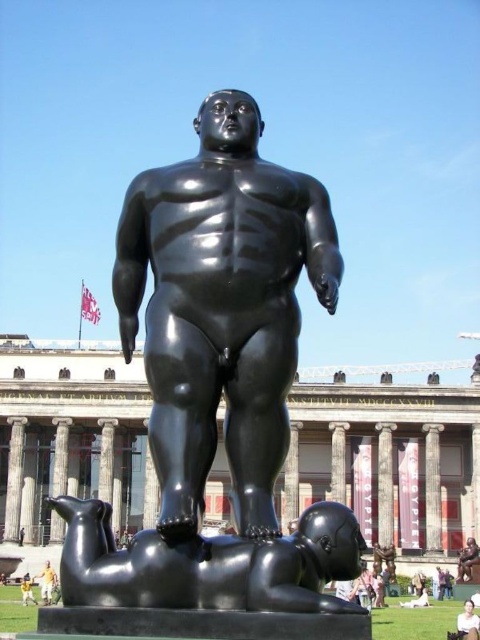
Is smooth gray stone pillar at center positioned at the back of smooth skin person at center?

Yes.

Does smooth gray stone pillar at center have a greater width compared to smooth skin person at center?

In fact, smooth gray stone pillar at center might be narrower than smooth skin person at center.

Between point (19, 440) and point (466, 609), which one is positioned in front?

Point (466, 609) is more forward.

The width and height of the screenshot is (480, 640). I want to click on smooth gray stone pillar at center, so click(x=13, y=477).

Can you confirm if black glossy statue at center is positioned above bronze column at center?

Indeed, black glossy statue at center is positioned over bronze column at center.

Does point (272, 467) lie behind point (54, 492)?

No, (272, 467) is in front of (54, 492).

I want to click on black glossy statue at center, so click(220, 307).

Where is `black glossy statue at center`? The width and height of the screenshot is (480, 640). black glossy statue at center is located at coordinates (220, 307).

The height and width of the screenshot is (640, 480). What do you see at coordinates (208, 563) in the screenshot?
I see `glossy black dog at lower center` at bounding box center [208, 563].

Is glossy black dog at lower center taller than smooth gray stone pillar at center?

No.

This screenshot has width=480, height=640. What are the coordinates of `glossy black dog at lower center` in the screenshot? It's located at (208, 563).

Identify the location of glossy black dog at lower center. (208, 563).